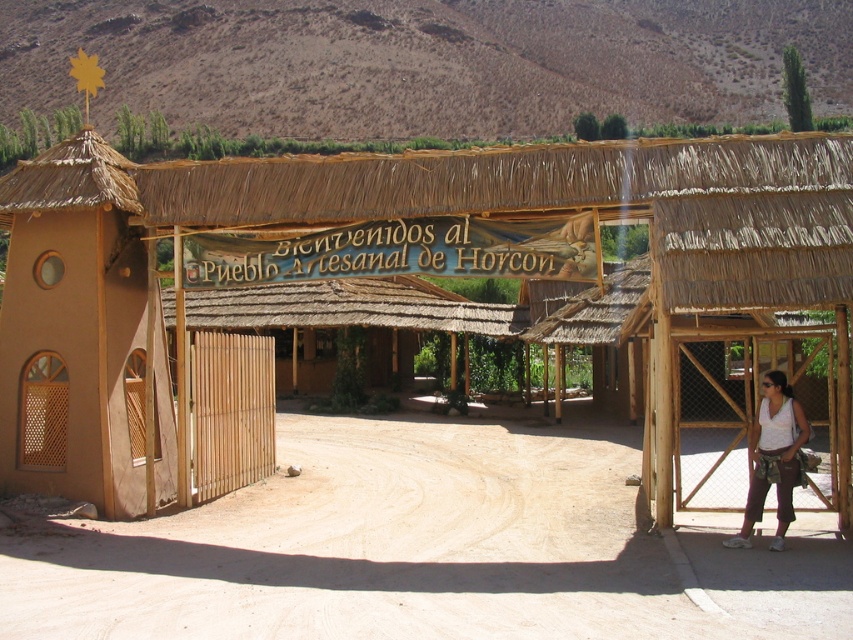
Question: Which of the following is the farthest from the observer?

Choices:
 (A) (306, 243)
 (B) (502, 272)
 (C) (781, 502)

Answer: (A)

Question: Can you confirm if thatched straw hut at center is positioned below wooden sign at center?

Choices:
 (A) yes
 (B) no

Answer: (A)

Question: Observing the image, what is the correct spatial positioning of wooden sign at center in reference to white fabric pants at right?

Choices:
 (A) left
 (B) right

Answer: (A)

Question: Which of the following is the closest to the observer?

Choices:
 (A) white fabric pants at right
 (B) wooden sign at center

Answer: (A)

Question: Is thatched straw hut at center thinner than white fabric pants at right?

Choices:
 (A) no
 (B) yes

Answer: (A)

Question: Which point appears farthest from the camera in this image?

Choices:
 (A) (410, 241)
 (B) (82, 627)
 (C) (137, 186)
 (D) (786, 516)

Answer: (C)